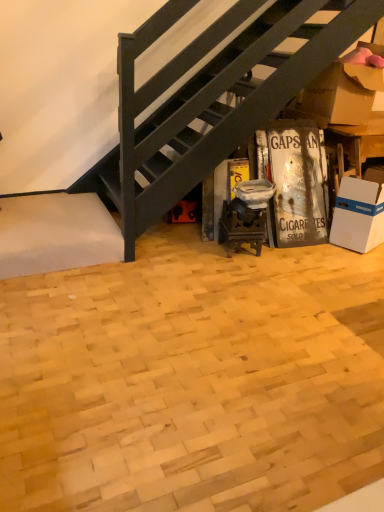
This screenshot has height=512, width=384. Identify the location of brown cardboard box at upper right. (342, 94).

The height and width of the screenshot is (512, 384). What do you see at coordinates (342, 94) in the screenshot?
I see `brown cardboard box at upper right` at bounding box center [342, 94].

Measure the distance between white cardboard box at lower right and camera.

3.03 meters.

I want to click on white cardboard box at lower right, so pos(358,215).

Identify the location of natural wood parquet floor at center. This screenshot has height=512, width=384. (193, 380).

From a real-world perspective, which object rests below the other?

natural wood parquet floor at center.

Which is more to the left, white cardboard box at lower right or natural wood parquet floor at center?

From the viewer's perspective, natural wood parquet floor at center appears more on the left side.

Is natural wood parquet floor at center at the back of white cardboard box at lower right?

white cardboard box at lower right does not have its back to natural wood parquet floor at center.

Are natural wood parquet floor at center and brown cardboard box at upper right far apart?

natural wood parquet floor at center is far away from brown cardboard box at upper right.

Does natural wood parquet floor at center appear on the right side of brown cardboard box at upper right?

Incorrect, natural wood parquet floor at center is not on the right side of brown cardboard box at upper right.

How different are the orientations of natural wood parquet floor at center and brown cardboard box at upper right in degrees?

89.9 degrees separate the facing orientations of natural wood parquet floor at center and brown cardboard box at upper right.

Is natural wood parquet floor at center oriented away from brown cardboard box at upper right?

natural wood parquet floor at center does not have its back to brown cardboard box at upper right.

I want to click on box positioned vertically above the natural wood parquet floor at center (from a real-world perspective), so click(358, 215).

From the image's perspective, which one is positioned lower, natural wood parquet floor at center or white cardboard box at lower right?

natural wood parquet floor at center.

Is natural wood parquet floor at center facing towards white cardboard box at lower right?

No.

Is brown cardboard box at upper right at the back of white cardboard box at lower right?

white cardboard box at lower right does not have its back to brown cardboard box at upper right.

I want to click on box that appears below the brown cardboard box at upper right (from a real-world perspective), so click(x=358, y=215).

Can you see brown cardboard box at upper right touching white cardboard box at lower right?

No, brown cardboard box at upper right is not in contact with white cardboard box at lower right.

Is point (354, 75) positioned in front of point (338, 213)?

No, (354, 75) is further to viewer.

Where is `box below the brown cardboard box at upper right (from the image's perspective)`? box below the brown cardboard box at upper right (from the image's perspective) is located at coordinates (358, 215).

Is brown cardboard box at upper right behind natural wood parquet floor at center?

Yes, brown cardboard box at upper right is further from the camera.

Are brown cardboard box at upper right and natural wood parquet floor at center beside each other?

No, brown cardboard box at upper right is not touching natural wood parquet floor at center.

In the scene shown: From a real-world perspective, is brown cardboard box at upper right located higher than natural wood parquet floor at center?

Yes, from a real-world perspective, brown cardboard box at upper right is on top of natural wood parquet floor at center.

Locate an element on the screen. cardboard box above the natural wood parquet floor at center (from a real-world perspective) is located at coordinates point(342,94).

Image resolution: width=384 pixels, height=512 pixels. Find the location of `box above the natural wood parquet floor at center (from a real-world perspective)`. box above the natural wood parquet floor at center (from a real-world perspective) is located at coordinates (358, 215).

Where is `plywood on the left of the brown cardboard box at upper right`? The image size is (384, 512). plywood on the left of the brown cardboard box at upper right is located at coordinates (193, 380).

Looking at the image, which one is located further to white cardboard box at lower right, brown cardboard box at upper right or natural wood parquet floor at center?

Based on the image, natural wood parquet floor at center appears to be further to white cardboard box at lower right.

From the picture: Considering their positions, is natural wood parquet floor at center positioned further to brown cardboard box at upper right than white cardboard box at lower right?

Among the two, natural wood parquet floor at center is located further to brown cardboard box at upper right.

Looking at the image, which one is located closer to natural wood parquet floor at center, white cardboard box at lower right or brown cardboard box at upper right?

white cardboard box at lower right lies closer to natural wood parquet floor at center than the other object.

Based on their spatial positions, is brown cardboard box at upper right or white cardboard box at lower right further from natural wood parquet floor at center?

brown cardboard box at upper right is positioned further to the anchor natural wood parquet floor at center.

Consider the image. Looking at the image, which one is located closer to white cardboard box at lower right, natural wood parquet floor at center or brown cardboard box at upper right?

brown cardboard box at upper right lies closer to white cardboard box at lower right than the other object.

Looking at the image, which one is located further to brown cardboard box at upper right, white cardboard box at lower right or natural wood parquet floor at center?

natural wood parquet floor at center lies further to brown cardboard box at upper right than the other object.

At what (x,y) coordinates should I click in order to perform the action: click on box positioned between natural wood parquet floor at center and brown cardboard box at upper right from near to far. Please return your answer as a coordinate pair (x, y). The width and height of the screenshot is (384, 512). Looking at the image, I should click on (358, 215).